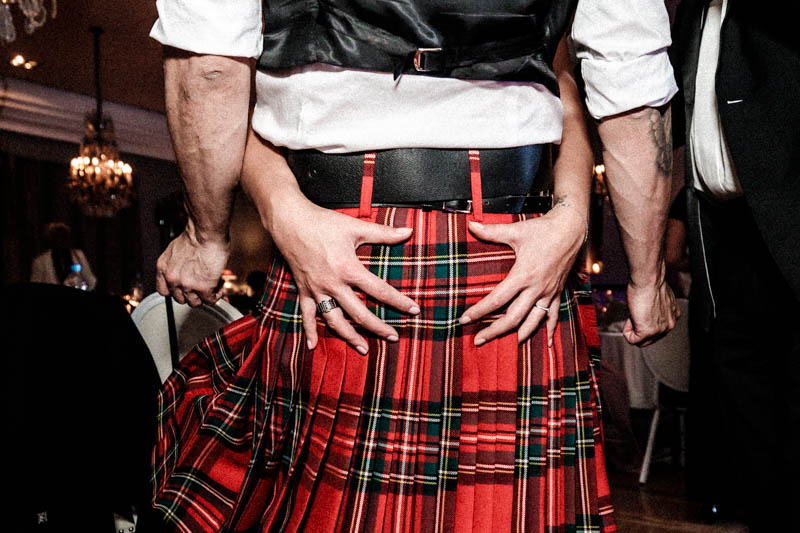
At what (x,y) coordinates should I click in order to perform the action: click on small gold lights. Please return your answer as a coordinate pair (x, y). Looking at the image, I should click on (18, 60), (28, 63).